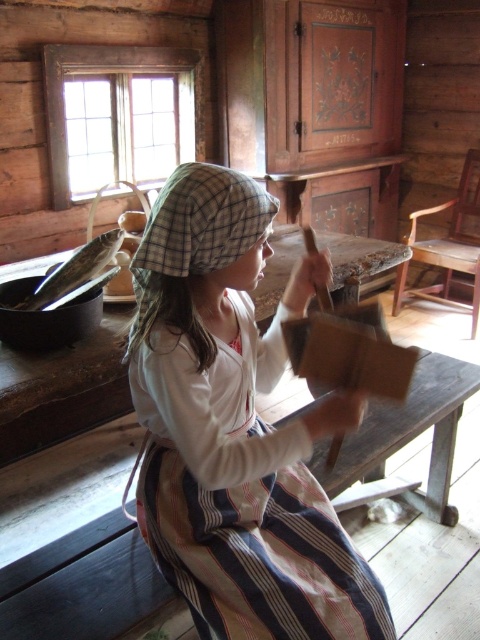
You are a visitor standing in front of the wooden bench and observing the striped cotton apron at center and the plaid fabric hat at center. Which object is closer to you?

The striped cotton apron at center is closer to you because it is further to the viewer than the plaid fabric hat at center.

Based on the scene description and the coordinates provided, can you identify the object located at point (236, 428)?

The point (236, 428) corresponds to the striped cotton apron at center.

You are a costume designer preparing for a historical play. You have two items from the image to choose from for the lead actor. The striped cotton apron at center and the plaid fabric hat at center. Which item would you recommend to be worn first if the actor needs to put on both items without adjusting them afterward?

The striped cotton apron at center should be put on first because it is larger in size than the plaid fabric hat at center, making it easier to adjust over the head without disturbing the hat afterward.